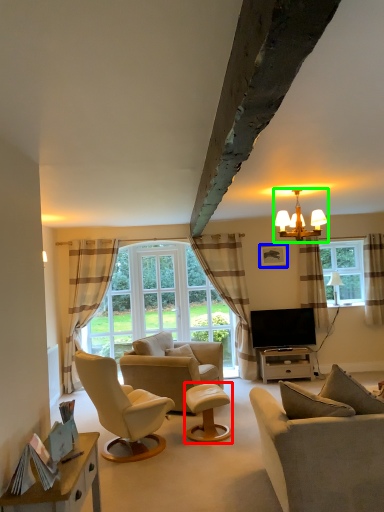
Question: Considering the real-world distances, which object is closest to stool (highlighted by a red box)? picture frame (highlighted by a blue box) or lamp (highlighted by a green box).

Choices:
 (A) picture frame
 (B) lamp

Answer: (B)